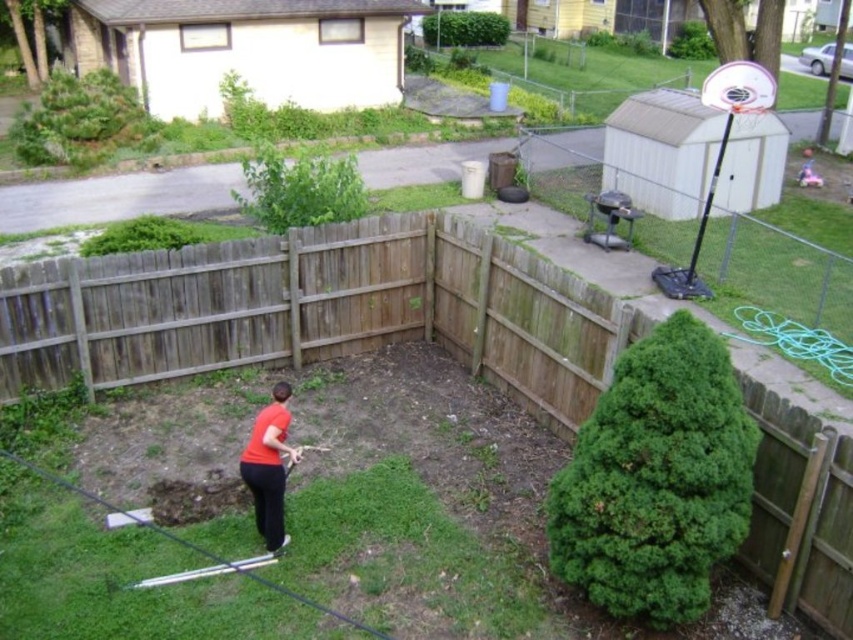
Is brown wood fence at center taller than white plastic basketball hoop at upper right?

In fact, brown wood fence at center may be shorter than white plastic basketball hoop at upper right.

Can you confirm if brown wood fence at center is positioned below white plastic basketball hoop at upper right?

Yes.

Is point (10, 348) positioned in front of point (729, 115)?

Yes.

Where is `brown wood fence at center`? The height and width of the screenshot is (640, 853). brown wood fence at center is located at coordinates (318, 310).

Can you confirm if weathered wood fence at center is thinner than white plastic basketball hoop at upper right?

Correct, weathered wood fence at center's width is less than white plastic basketball hoop at upper right's.

Is point (436, 324) positioned behind point (762, 92)?

That is True.

Which is behind, point (398, 228) or point (735, 84)?

Positioned behind is point (398, 228).

Locate an element on the screen. The image size is (853, 640). weathered wood fence at center is located at coordinates (316, 310).

Who is positioned more to the left, weathered wood fence at center or matte orange shirt at lower left?

Positioned to the left is weathered wood fence at center.

Does point (422, 275) come behind point (294, 458)?

Yes.

Is point (479, 314) positioned after point (264, 513)?

Yes, it is.

This screenshot has width=853, height=640. Find the location of `weathered wood fence at center`. weathered wood fence at center is located at coordinates coord(316,310).